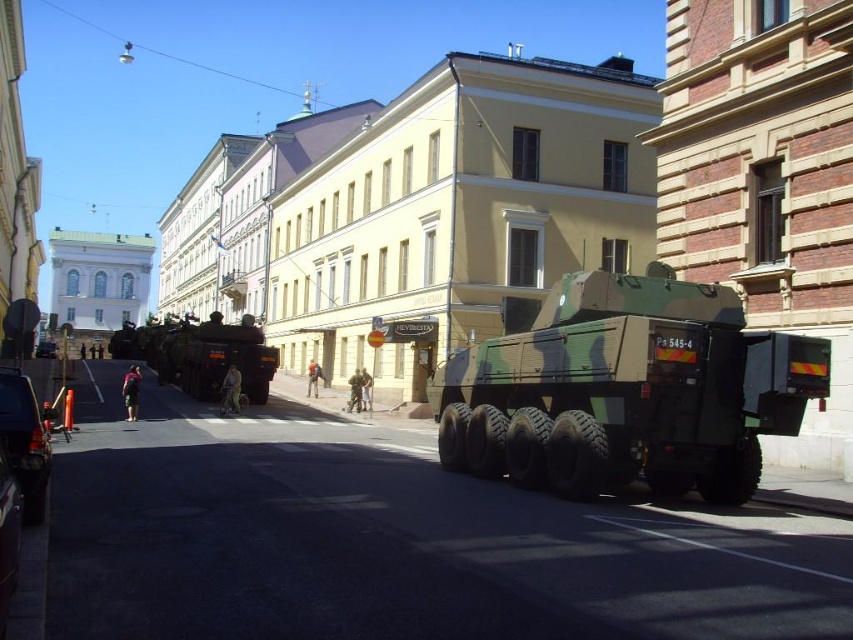
Question: Which of the following is the closest to the observer?

Choices:
 (A) camouflage fabric tank at center
 (B) camouflage fabric military truck at center
 (C) metallic blue truck at lower left
 (D) matte black tank at left

Answer: (C)

Question: Does camouflage fabric tank at center have a smaller size compared to camouflage fabric military truck at center?

Choices:
 (A) no
 (B) yes

Answer: (B)

Question: Can you confirm if matte black tank at left is positioned below camouflage fabric military truck at center?

Choices:
 (A) yes
 (B) no

Answer: (B)

Question: Which point appears closest to the camera in this image?

Choices:
 (A) (38, 449)
 (B) (199, 355)

Answer: (A)

Question: Among these points, which one is nearest to the camera?

Choices:
 (A) (177, 346)
 (B) (795, 378)
 (C) (27, 522)
 (D) (55, 342)

Answer: (C)

Question: Does metallic blue truck at lower left appear under camouflage fabric military truck at center?

Choices:
 (A) yes
 (B) no

Answer: (B)